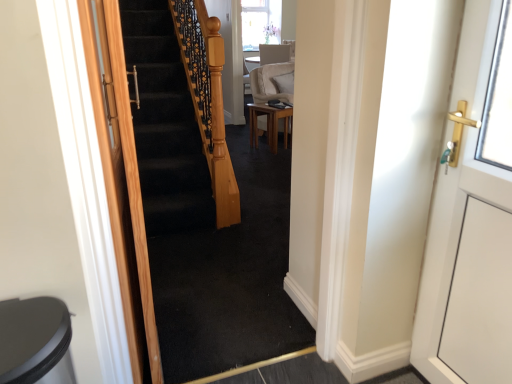
Find the location of a particular element. light brown wooden table at center is located at coordinates (269, 124).

This screenshot has height=384, width=512. What do you see at coordinates (206, 222) in the screenshot? I see `black carpeted stairs at center` at bounding box center [206, 222].

The image size is (512, 384). What do you see at coordinates (122, 183) in the screenshot? I see `wooden door at left, the second door in the right-to-left sequence` at bounding box center [122, 183].

At what (x,y) coordinates should I click in order to perform the action: click on suede beige armchair at center. Please return your answer as a coordinate pair (x, y). Image resolution: width=512 pixels, height=384 pixels. Looking at the image, I should click on (273, 74).

Considering the points (168, 26) and (276, 55), which point is behind, point (168, 26) or point (276, 55)?

Point (276, 55)

Relative to suede beige armchair at center, is black carpeted stairs at center in front or behind?

In the image, black carpeted stairs at center appears in front of suede beige armchair at center.

Can you tell me how much black carpeted stairs at center and suede beige armchair at center differ in facing direction?

The angle between the facing direction of black carpeted stairs at center and the facing direction of suede beige armchair at center is 147 degrees.

Based on the photo, considering the sizes of objects black carpeted stairs at center and suede beige armchair at center in the image provided, who is thinner, black carpeted stairs at center or suede beige armchair at center?

Thinner between the two is black carpeted stairs at center.

Who is smaller, suede beige armchair at center or light brown wooden table at center?

Smaller between the two is light brown wooden table at center.

Is suede beige armchair at center inside the boundaries of light brown wooden table at center, or outside?

suede beige armchair at center is not inside light brown wooden table at center, it's outside.

Considering the positions of point (284, 46) and point (251, 107), is point (284, 46) closer or farther from the camera than point (251, 107)?

Clearly, point (284, 46) is more distant from the camera than point (251, 107).

How many degrees apart are the facing directions of suede beige armchair at center and white glossy door at right, arranged as the first door when viewed from the right?

The facing directions of suede beige armchair at center and white glossy door at right, arranged as the first door when viewed from the right, are 124 degrees apart.

Is white glossy door at right, arranged as the first door when viewed from the right, at the back of suede beige armchair at center?

Absolutely, suede beige armchair at center is directed away from white glossy door at right, arranged as the first door when viewed from the right.

Is suede beige armchair at center far from white glossy door at right, the 2th door from the left?

Yes, suede beige armchair at center is far from white glossy door at right, the 2th door from the left.

Considering the sizes of objects suede beige armchair at center and white glossy door at right, arranged as the first door when viewed from the right, in the image provided, who is wider, suede beige armchair at center or white glossy door at right, arranged as the first door when viewed from the right,?

Wider between the two is suede beige armchair at center.

Considering the positions of objects light brown wooden table at center and suede beige armchair at center in the image provided, who is more to the right, light brown wooden table at center or suede beige armchair at center?

suede beige armchair at center is more to the right.

Is light brown wooden table at center far away from suede beige armchair at center?

Actually, light brown wooden table at center and suede beige armchair at center are a little close together.

From a real-world perspective, which is physically above, light brown wooden table at center or suede beige armchair at center?

suede beige armchair at center is physically above.

Is light brown wooden table at center turned away from suede beige armchair at center?

No.

Is point (291, 98) closer or farther from the camera than point (154, 149)?

Point (291, 98) is farther from the camera than point (154, 149).

In terms of size, does suede beige armchair at center appear bigger or smaller than black carpeted stairs at center?

Considering their sizes, suede beige armchair at center takes up more space than black carpeted stairs at center.

Considering the relative sizes of suede beige armchair at center and black carpeted stairs at center in the image provided, is suede beige armchair at center taller than black carpeted stairs at center?

No.

Does suede beige armchair at center touch black carpeted stairs at center?

No, suede beige armchair at center is not in contact with black carpeted stairs at center.

There is a suede beige armchair at center. At what (x,y) coordinates should I click in order to perform the action: click on the 2nd door above it (from a real-world perspective). Please return your answer as a coordinate pair (x, y). Looking at the image, I should click on (470, 259).

Is point (422, 280) positioned in front of point (265, 45)?

Yes, point (422, 280) is in front of point (265, 45).

From the image's perspective, is white glossy door at right, the 2th door from the left, above suede beige armchair at center?

Actually, white glossy door at right, the 2th door from the left, appears below suede beige armchair at center in the image.

From a real-world perspective, who is located lower, black carpeted stairs at center or wooden door at left, the second door in the right-to-left sequence?

wooden door at left, the second door in the right-to-left sequence.

Can you tell me how much black carpeted stairs at center and wooden door at left, the second door in the right-to-left sequence, differ in facing direction?

black carpeted stairs at center and wooden door at left, the second door in the right-to-left sequence, are facing 86.7 degrees away from each other.

Considering the sizes of black carpeted stairs at center and wooden door at left, the second door in the right-to-left sequence, in the image, is black carpeted stairs at center taller or shorter than wooden door at left, the second door in the right-to-left sequence,?

In the image, black carpeted stairs at center appears to be shorter than wooden door at left, the second door in the right-to-left sequence.

Where is `escalator lying below the wooden door at left, placed as the first door when sorted from left to right (from the image's perspective)`? The width and height of the screenshot is (512, 384). escalator lying below the wooden door at left, placed as the first door when sorted from left to right (from the image's perspective) is located at coordinates (206, 222).

Image resolution: width=512 pixels, height=384 pixels. Find the location of `escalator that is above the suede beige armchair at center (from a real-world perspective)`. escalator that is above the suede beige armchair at center (from a real-world perspective) is located at coordinates (206, 222).

In the image, there is a suede beige armchair at center. Where is `table below it (from a real-world perspective)`? table below it (from a real-world perspective) is located at coordinates (269, 124).

Considering their positions, is white glossy door at right, arranged as the first door when viewed from the right, positioned further to black carpeted stairs at center than wooden door at left, the second door in the right-to-left sequence?

Among the two, white glossy door at right, arranged as the first door when viewed from the right, is located further to black carpeted stairs at center.

From the image, which object appears to be nearer to light brown wooden table at center, wooden door at left, the second door in the right-to-left sequence, or black carpeted stairs at center?

black carpeted stairs at center lies closer to light brown wooden table at center than the other object.

From the image, which object appears to be nearer to suede beige armchair at center, white glossy door at right, the 2th door from the left, or wooden door at left, placed as the first door when sorted from left to right?

wooden door at left, placed as the first door when sorted from left to right, lies closer to suede beige armchair at center than the other object.

From the image, which object appears to be nearer to white glossy door at right, arranged as the first door when viewed from the right, black carpeted stairs at center or wooden door at left, the second door in the right-to-left sequence?

wooden door at left, the second door in the right-to-left sequence, is positioned closer to the anchor white glossy door at right, arranged as the first door when viewed from the right.

Estimate the real-world distances between objects in this image. Which object is further from white glossy door at right, the 2th door from the left, wooden door at left, the second door in the right-to-left sequence, or light brown wooden table at center?

light brown wooden table at center is positioned further to the anchor white glossy door at right, the 2th door from the left.

Which object lies nearer to the anchor point white glossy door at right, the 2th door from the left, light brown wooden table at center or black carpeted stairs at center?

black carpeted stairs at center is closer to white glossy door at right, the 2th door from the left.

When comparing their distances from black carpeted stairs at center, does wooden door at left, placed as the first door when sorted from left to right, or suede beige armchair at center seem further?

The object further to black carpeted stairs at center is suede beige armchair at center.

Based on their spatial positions, is light brown wooden table at center or wooden door at left, the second door in the right-to-left sequence, closer to black carpeted stairs at center?

The object closer to black carpeted stairs at center is wooden door at left, the second door in the right-to-left sequence.

At what (x,y) coordinates should I click in order to perform the action: click on escalator positioned between white glossy door at right, arranged as the first door when viewed from the right, and suede beige armchair at center from near to far. Please return your answer as a coordinate pair (x, y). Image resolution: width=512 pixels, height=384 pixels. Looking at the image, I should click on (206, 222).

Locate an element on the screen. door between white glossy door at right, the 2th door from the left, and suede beige armchair at center from front to back is located at coordinates (122, 183).

Find the location of a particular element. This screenshot has height=384, width=512. escalator between white glossy door at right, arranged as the first door when viewed from the right, and light brown wooden table at center from front to back is located at coordinates (206, 222).

You are a GUI agent. You are given a task and a screenshot of the screen. Output one action in this format:
    pyautogui.click(x=<x>, y=<y>)
    Task: Click on the door positioned between black carpeted stairs at center and suede beige armchair at center from near to far
    This screenshot has width=512, height=384.
    Given the screenshot: What is the action you would take?
    pyautogui.click(x=122, y=183)